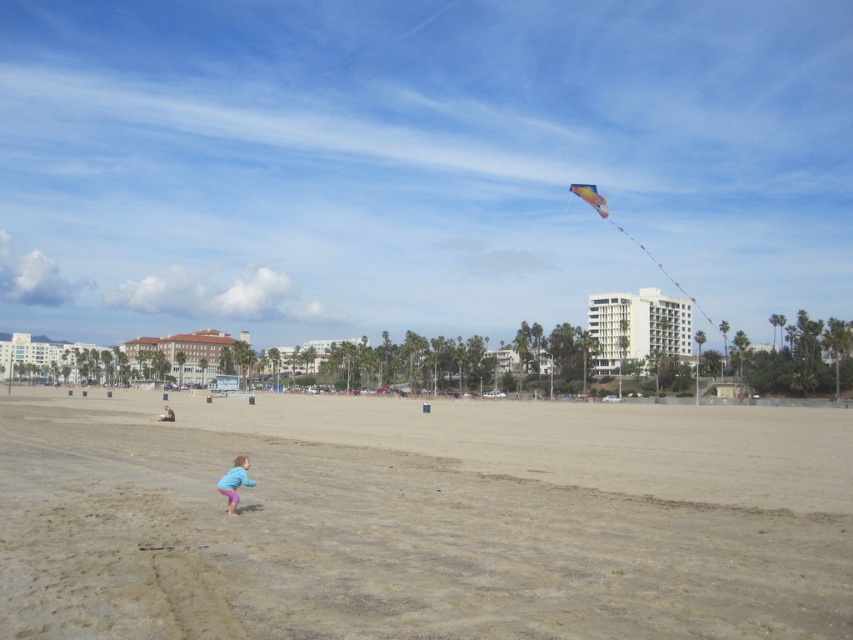
Between multicolored fabric kite at upper right and blue cotton shirt at lower center, which one is positioned lower?

blue cotton shirt at lower center is below.

Does point (582, 186) come farther from viewer compared to point (167, 410)?

Yes, point (582, 186) is behind point (167, 410).

Where is `multicolored fabric kite at upper right`? This screenshot has width=853, height=640. multicolored fabric kite at upper right is located at coordinates (628, 236).

Who is taller, brown sandy beach at center or blue cotton shirt at lower center?

Standing taller between the two is brown sandy beach at center.

This screenshot has width=853, height=640. What are the coordinates of `brown sandy beach at center` in the screenshot? It's located at (422, 518).

Who is more forward, (666, 298) or (691, 301)?

Point (666, 298)

Between point (622, 292) and point (590, 198), which one is positioned in front?

Point (590, 198)

At what (x,y) coordinates should I click in order to perform the action: click on white glossy building at upper center. Please return your answer as a coordinate pair (x, y). This screenshot has height=640, width=853. Looking at the image, I should click on (637, 328).